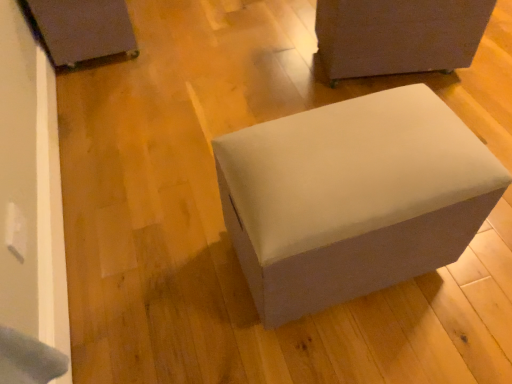
Question: Is suede-like gray ottoman at center, placed as the 2th furniture when sorted from right to left, spatially inside matte black box at upper left, the first furniture in the left-to-right sequence, or outside of it?

Choices:
 (A) outside
 (B) inside

Answer: (A)

Question: In terms of size, does suede-like gray ottoman at center, which appears as the 2th furniture when viewed from the left, appear bigger or smaller than matte black box at upper left, acting as the third furniture starting from the right?

Choices:
 (A) small
 (B) big

Answer: (B)

Question: Which of these objects is positioned closest to the matte black box at upper left, the first furniture in the left-to-right sequence?

Choices:
 (A) suede-like gray ottoman at center, which appears as the 2th furniture when viewed from the left
 (B) matte gray ottoman at upper right, arranged as the 3th furniture when viewed from the left

Answer: (B)

Question: Estimate the real-world distances between objects in this image. Which object is farther from the matte black box at upper left, acting as the third furniture starting from the right?

Choices:
 (A) suede-like gray ottoman at center, which appears as the 2th furniture when viewed from the left
 (B) matte gray ottoman at upper right, the 1th furniture in the right-to-left sequence

Answer: (A)